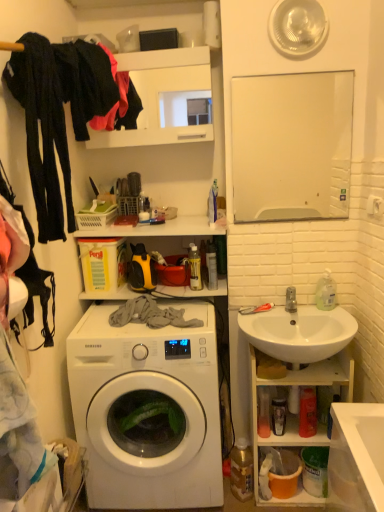
Question: From the image's perspective, relative to black cotton pants at left, placed as the second clothing when sorted from back to front, is white glossy mirror at upper center above or below?

Choices:
 (A) below
 (B) above

Answer: (B)

Question: In terms of width, does white glossy mirror at upper center look wider or thinner when compared to black cotton pants at left, marked as the first clothing in a front-to-back arrangement?

Choices:
 (A) wide
 (B) thin

Answer: (B)

Question: Estimate the real-world distances between objects in this image. Which object is closer to the clear plastic bottle at right?

Choices:
 (A) white ceramic sink at right
 (B) black fabric at upper left, placed as the first clothing when sorted from back to front
 (C) white glossy mirror at upper center
 (D) white glossy sink at lower right
 (E) black cotton pants at left, marked as the first clothing in a front-to-back arrangement

Answer: (A)

Question: Which object is the closest to the white glossy washing machine at center?

Choices:
 (A) silver metallic faucet at sink right
 (B) white glossy sink at lower right
 (C) black fabric at upper left, marked as the 2th clothing in a front-to-back arrangement
 (D) clear plastic bottle at right
 (E) black cotton pants at left, marked as the first clothing in a front-to-back arrangement

Answer: (B)